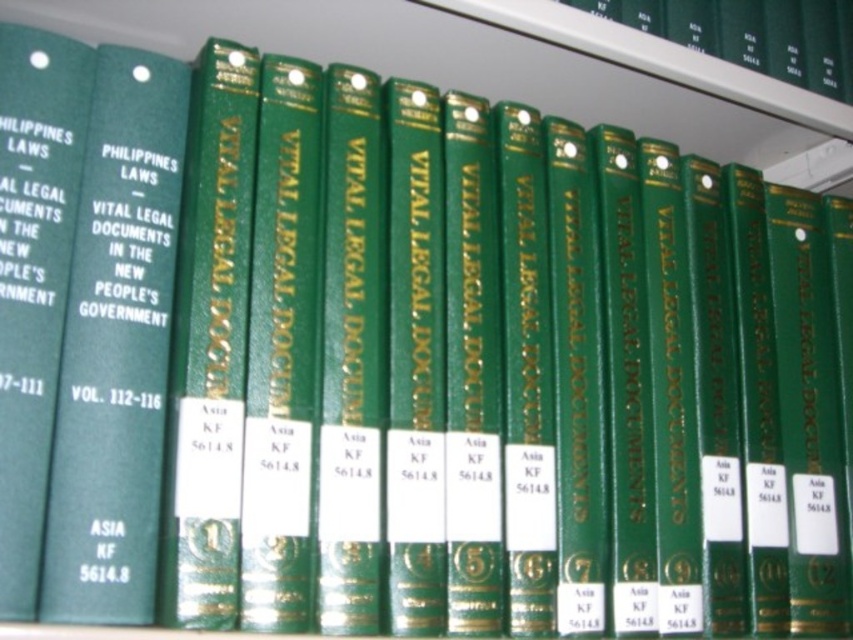
You are organizing a library shelf and need to ensure that the green hardcover book at center and the green hardcover book at left are spaced appropriately. Based on their widths, which book requires more horizontal space on the shelf?

The green hardcover book at center requires more horizontal space on the shelf because it might be wider than the green hardcover book at left according to the description.

You are a librarian who needs to place a new book that is 10 inches wide onto the shelf. The existing books are arranged in a row with a space between them. Can you fit the new book between the two books at the point labeled as point (140, 93)?

The space between the two books at point (140, 93) is 22.15 inches wide. Since the new book is only 10 inches wide, it can easily fit into the space between the two books at point (140, 93).